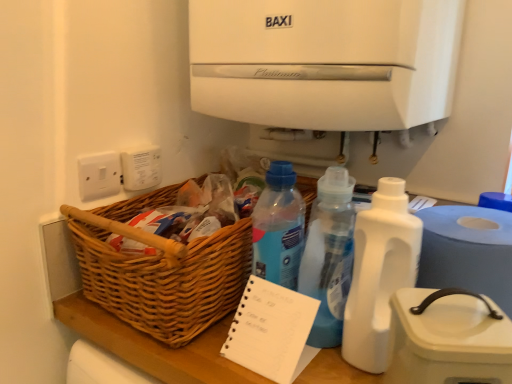
Question: From the image's perspective, would you say translucent plastic bottle at center, arranged as the first bottle when viewed from the left, is shown under white plastic paper towel at lower right?

Choices:
 (A) no
 (B) yes

Answer: (A)

Question: From a real-world perspective, is translucent plastic bottle at center, which appears as the 2th bottle when viewed from the right, below white plastic paper towel at lower right?

Choices:
 (A) no
 (B) yes

Answer: (A)

Question: From the image's perspective, is translucent plastic bottle at center, arranged as the first bottle when viewed from the left, on top of white plastic paper towel at lower right?

Choices:
 (A) no
 (B) yes

Answer: (B)

Question: Does translucent plastic bottle at center, which appears as the 2th bottle when viewed from the right, lie in front of white plastic paper towel at lower right?

Choices:
 (A) yes
 (B) no

Answer: (B)

Question: Is translucent plastic bottle at center, which appears as the 2th bottle when viewed from the right, next to white plastic paper towel at lower right?

Choices:
 (A) no
 (B) yes

Answer: (A)

Question: Does translucent plastic bottle at center, which appears as the 2th bottle when viewed from the right, lie behind white plastic paper towel at lower right?

Choices:
 (A) no
 (B) yes

Answer: (B)

Question: Is white plastic electric outlet at upper left, which is the 2th electric outlet from left to right, wider than white matte water cooler at upper center?

Choices:
 (A) yes
 (B) no

Answer: (B)

Question: Are white plastic electric outlet at upper left, which is the 2th electric outlet from left to right, and white matte water cooler at upper center located far from each other?

Choices:
 (A) yes
 (B) no

Answer: (B)

Question: Is white plastic electric outlet at upper left, which is the 2th electric outlet from left to right, at the left side of white matte water cooler at upper center?

Choices:
 (A) no
 (B) yes

Answer: (B)

Question: Does white plastic electric outlet at upper left, which is the 2th electric outlet from left to right, have a greater height compared to white matte water cooler at upper center?

Choices:
 (A) no
 (B) yes

Answer: (A)

Question: Is the depth of white plastic electric outlet at upper left, which is the 2th electric outlet from left to right, greater than that of white matte water cooler at upper center?

Choices:
 (A) no
 (B) yes

Answer: (B)

Question: Can you see white plastic electric outlet at upper left, acting as the first electric outlet starting from the right, touching white matte water cooler at upper center?

Choices:
 (A) no
 (B) yes

Answer: (A)

Question: Could you tell me if white spiral-bound notepad at center is turned towards woven wood basket at lower left?

Choices:
 (A) yes
 (B) no

Answer: (B)